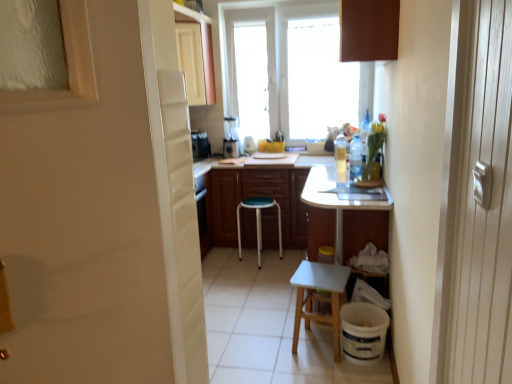
The image size is (512, 384). Identify the location of vacant space underneath metallic silver blender at center (from a real-world perspective). (232, 157).